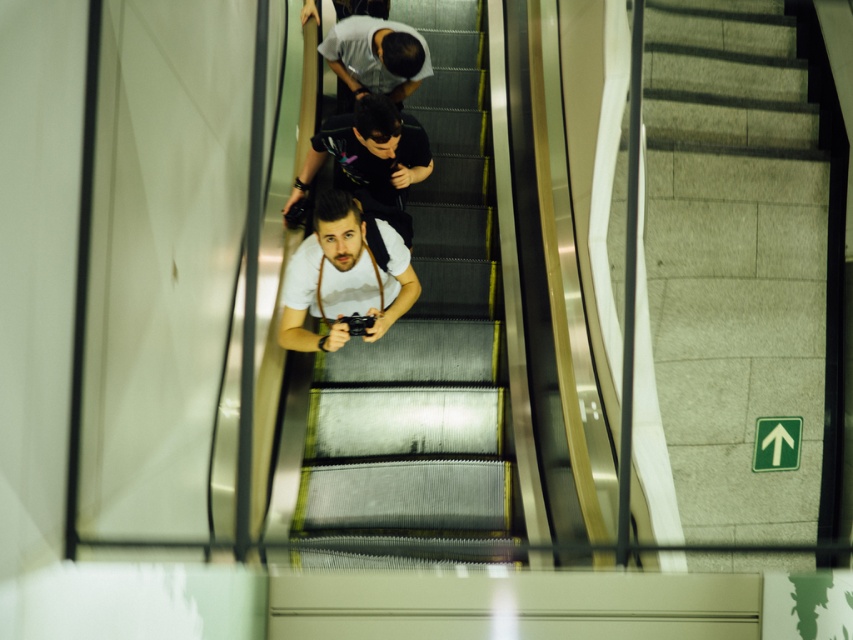
Who is taller, white matte shirt at center or matte black camera at center?

matte black camera at center

At what (x,y) coordinates should I click in order to perform the action: click on white matte shirt at center. Please return your answer as a coordinate pair (x, y). The width and height of the screenshot is (853, 640). Looking at the image, I should click on (343, 280).

At what (x,y) coordinates should I click in order to perform the action: click on white matte shirt at center. Please return your answer as a coordinate pair (x, y). Image resolution: width=853 pixels, height=640 pixels. Looking at the image, I should click on (343, 280).

In the scene shown: Between matte black camera at center and matte black shirt at upper center, which one has more height?

With more height is matte black camera at center.

Is matte black camera at center wider than matte black shirt at upper center?

Correct, the width of matte black camera at center exceeds that of matte black shirt at upper center.

Where is `matte black camera at center`? This screenshot has width=853, height=640. matte black camera at center is located at coordinates (370, 157).

The height and width of the screenshot is (640, 853). In order to click on matte black camera at center in this screenshot , I will do `click(370, 157)`.

Can you confirm if metallic escalator steps at center is positioned to the right of matte black camera at center?

Yes, metallic escalator steps at center is to the right of matte black camera at center.

Between metallic escalator steps at center and matte black camera at center, which one is positioned higher?

matte black camera at center is above.

Does point (503, 518) come in front of point (393, 131)?

That is True.

The width and height of the screenshot is (853, 640). In order to click on metallic escalator steps at center in this screenshot , I will do `click(425, 348)`.